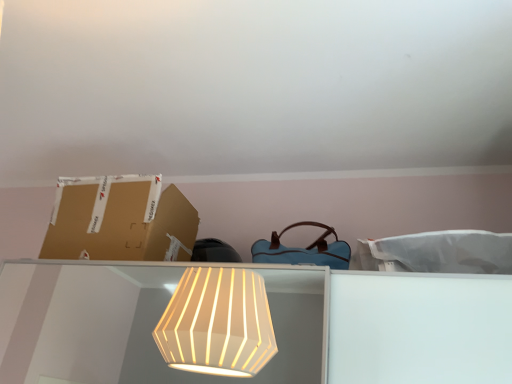
Identify the location of brown cardboard box at upper left. (120, 220).

Describe the element at coordinates (120, 220) in the screenshot. I see `brown cardboard box at upper left` at that location.

Find the location of a particular element. This screenshot has height=384, width=512. brown cardboard box at upper left is located at coordinates (120, 220).